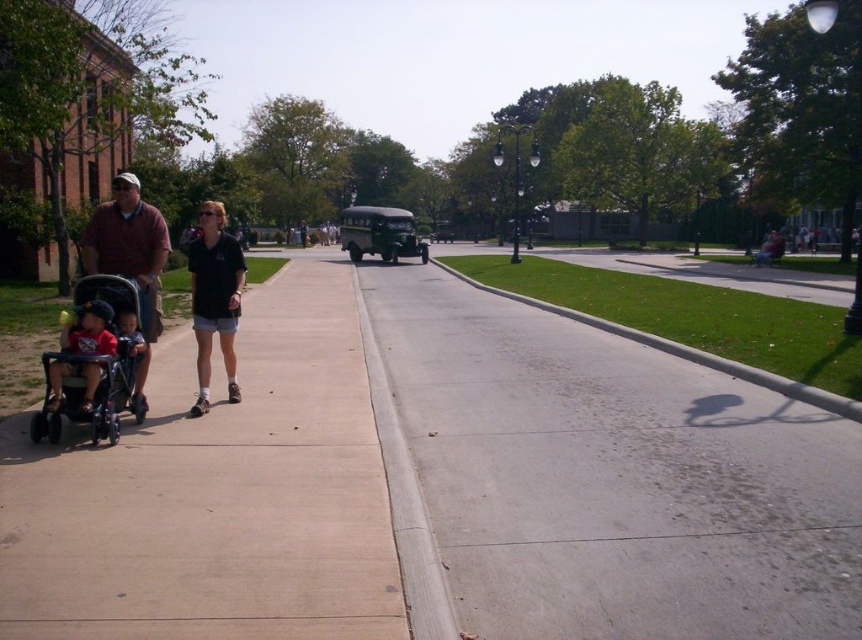
You are a delivery person trying to navigate a narrow path in the park. You see a black plastic stroller at left and a matte brown shirt at left. Which object is narrower and can be passed more easily?

The black plastic stroller at left is thinner than the matte brown shirt at left, so it can be passed more easily.

Based on the photo, you are standing on the grassy area to the right of the path and want to walk to the smooth concrete sidewalk at left. However, there is a matte black baby stroller at left in your way. Can you walk around it without stepping onto the grass?

The smooth concrete sidewalk at left is closer to the viewer than the matte black baby stroller at left, so the stroller is between you and the sidewalk. You can walk around the stroller either to the left or right along the sidewalk to reach your destination without stepping on the grass.

You are standing on the gray concrete sidewalk at center and want to greet the person wearing the black matte shirt at center. In which direction should you walk to reach them?

Since the gray concrete sidewalk at center is to the right of the black matte shirt at center, you should walk to your left to reach the person wearing the black matte shirt at center.